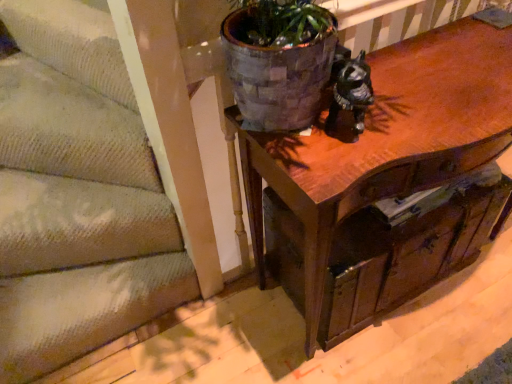
Question: From a real-world perspective, is wooden drawer at center under wooden table at center?

Choices:
 (A) no
 (B) yes

Answer: (B)

Question: Considering the relative positions of wooden drawer at center and wooden table at center in the image provided, is wooden drawer at center to the right of wooden table at center from the viewer's perspective?

Choices:
 (A) no
 (B) yes

Answer: (A)

Question: Would you say wooden table at center is part of wooden drawer at center's contents?

Choices:
 (A) yes
 (B) no

Answer: (A)

Question: Is wooden drawer at center turned away from wooden table at center?

Choices:
 (A) yes
 (B) no

Answer: (A)

Question: Considering the relative sizes of wooden drawer at center and wooden table at center in the image provided, is wooden drawer at center bigger than wooden table at center?

Choices:
 (A) no
 (B) yes

Answer: (A)

Question: Is wooden drawer at center aimed at wooden table at center?

Choices:
 (A) no
 (B) yes

Answer: (B)

Question: Is wooden drawer at center located outside textured beige carpet at lower left?

Choices:
 (A) yes
 (B) no

Answer: (A)

Question: Is wooden drawer at center placed right next to textured beige carpet at lower left?

Choices:
 (A) no
 (B) yes

Answer: (A)

Question: From a real-world perspective, is wooden drawer at center located higher than textured beige carpet at lower left?

Choices:
 (A) yes
 (B) no

Answer: (A)

Question: Is wooden drawer at center positioned with its back to textured beige carpet at lower left?

Choices:
 (A) no
 (B) yes

Answer: (A)

Question: From the image's perspective, is wooden drawer at center on top of textured beige carpet at lower left?

Choices:
 (A) yes
 (B) no

Answer: (A)

Question: Is there a large distance between wooden drawer at center and textured beige carpet at lower left?

Choices:
 (A) no
 (B) yes

Answer: (A)

Question: Considering the relative positions of wooden table at center and textured beige carpet at lower left in the image provided, is wooden table at center to the right of textured beige carpet at lower left from the viewer's perspective?

Choices:
 (A) no
 (B) yes

Answer: (B)